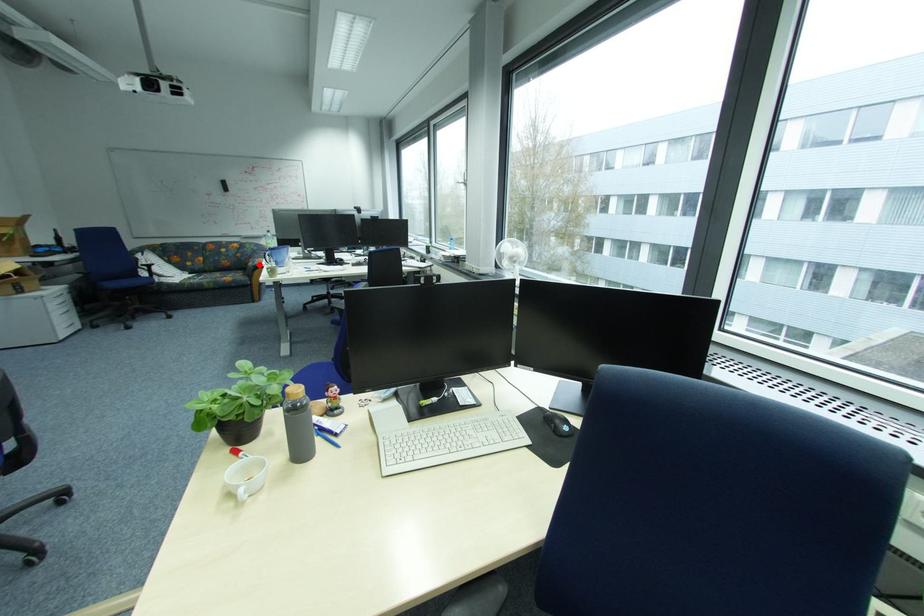
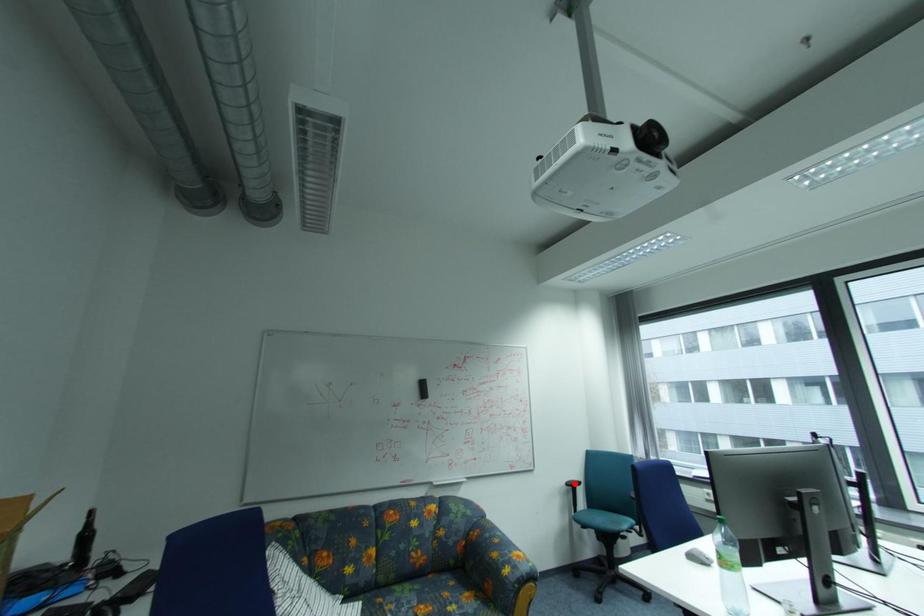
I am providing you with two images of the same scene from different viewpoints. A red point is marked on the first image and another point is marked on the second image. Does the point marked in image1 correspond to the same location as the one in image2?

No